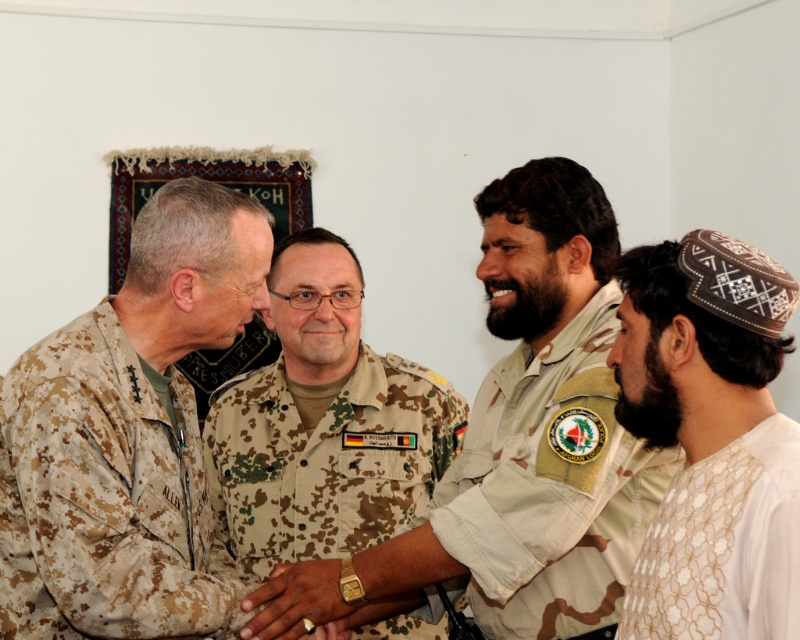
You are a photographer standing 1.5 meters away from the two individuals in the center wearing camouflage fabric uniform at center and camo fabric uniform at center. You want to take a photo of both of them without any part of their uniforms being cut off. What is the minimum width of the camera lens you need to use?

The minimum width of the camera lens needed is 65.72 centimeters to ensure both the camouflage fabric uniform at center and camo fabric uniform at center are fully captured without any part being cut off.

Based on the scene description, which individual is taller between the camouflage uniform at center and the white embroidered shirt at lower right?

The camouflage uniform at center is taller than the white embroidered shirt at lower right according to the description.

You are a photographer standing in front of the group of four individuals. You want to take a photo that includes both the point at position (88, 582) and the point at position (352, 452). Which point should you focus on first to ensure both are in clear view?

You should focus on point (88, 582) first because it is closer to the viewer than point (352, 452), ensuring both points are in focus.